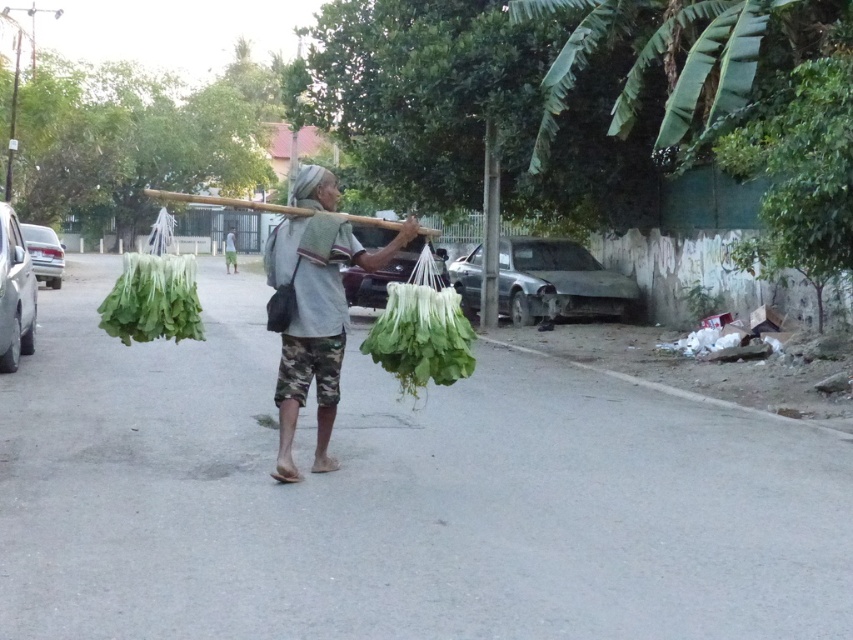
What is the 2D coordinate of the green leafy at center in the image?

The 2D coordinate of the green leafy at center is at point [421,332].

You are a drone operator trying to capture aerial footage of the scene. You need to fly the drone from point A to point B. Point A is at coordinates point (337,304) and point B is at coordinates point (426,365). Considering the spatial relationship between these two points, which point is closer to the camera and should be your starting position for the flight path?

Point (337,304) is closer to the camera than point (426,365), so you should start your flight path at point (337,304).

You are a delivery drone that needs to drop off a small package to the person carrying the green leafy vegetable at center and the gray fabric headscarf at center. The drone has a maximum delivery range of 5 meters. Can the drone deliver the package to both items at the same time?

The distance between the green leafy vegetable at center and the gray fabric headscarf at center is 4.63 meters, which is within the drone delivery range of 5 meters. Therefore, the drone can deliver the package to both items simultaneously.